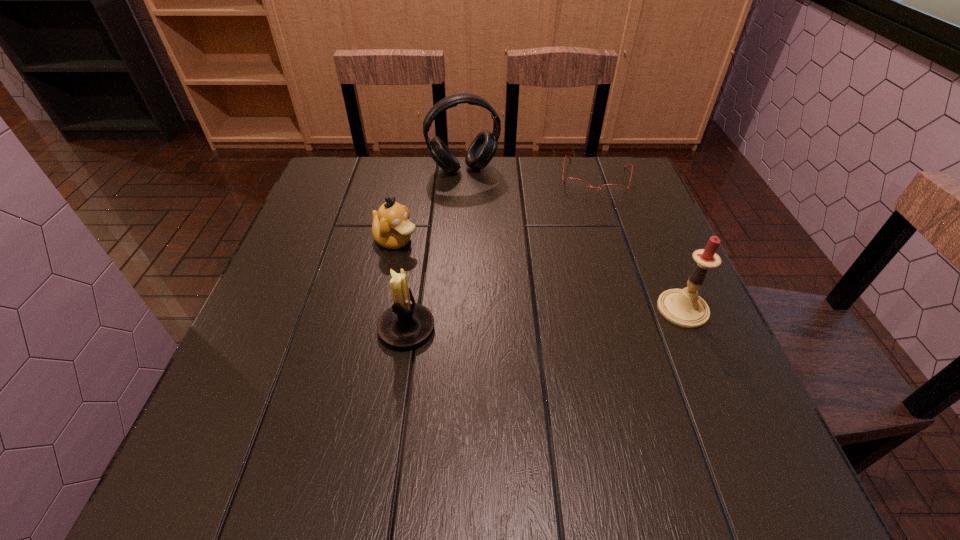
Locate an element on the screen. free area in between the spectacles and the candle is located at coordinates (638, 244).

Where is `free space between the third farthest object and the candle`? Image resolution: width=960 pixels, height=540 pixels. free space between the third farthest object and the candle is located at coordinates (540, 275).

At what (x,y) coordinates should I click in order to perform the action: click on empty space that is in between the third nearest object and the candle. Please return your answer as a coordinate pair (x, y). This screenshot has width=960, height=540. Looking at the image, I should click on (540, 275).

Find the location of a particular element. This screenshot has width=960, height=540. unoccupied area between the candle and the spectacles is located at coordinates (638, 244).

You are a GUI agent. You are given a task and a screenshot of the screen. Output one action in this format:
    pyautogui.click(x=<x>, y=<y>)
    Task: Click on the free area in between the candle and the spectacles
    This screenshot has width=960, height=540.
    Given the screenshot: What is the action you would take?
    pyautogui.click(x=638, y=244)

This screenshot has width=960, height=540. I want to click on free space that is in between the spectacles and the third nearest object, so click(495, 210).

Find the location of `vacant region between the candle and the headset`. vacant region between the candle and the headset is located at coordinates (573, 239).

Find the location of a particular element. The width and height of the screenshot is (960, 540). vacant area between the headset and the candle is located at coordinates (573, 239).

Choose which object is the third nearest neighbor to the headset. Please provide its 2D coordinates. Your answer should be formatted as a tuple, i.e. [(x, y)], where the tuple contains the x and y coordinates of a point satisfying the conditions above.

[(405, 324)]

Identify which object is the nearest to the candle holder. Please provide its 2D coordinates. Your answer should be formatted as a tuple, i.e. [(x, y)], where the tuple contains the x and y coordinates of a point satisfying the conditions above.

[(391, 228)]